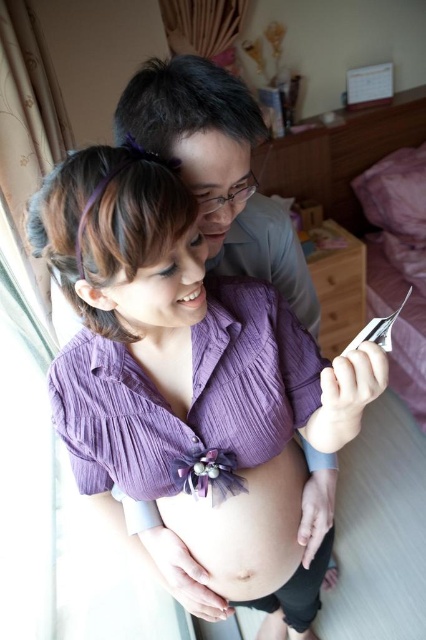
Question: Which object is closer to the camera taking this photo?

Choices:
 (A) smooth purple fabric at center
 (B) purple crinkled blouse at center

Answer: (B)

Question: Is purple crinkled blouse at center thinner than smooth purple fabric at center?

Choices:
 (A) no
 (B) yes

Answer: (A)

Question: In this image, where is purple crinkled blouse at center located relative to smooth purple fabric at center?

Choices:
 (A) right
 (B) left

Answer: (A)

Question: Does purple crinkled blouse at center have a lesser width compared to smooth purple fabric at center?

Choices:
 (A) no
 (B) yes

Answer: (A)